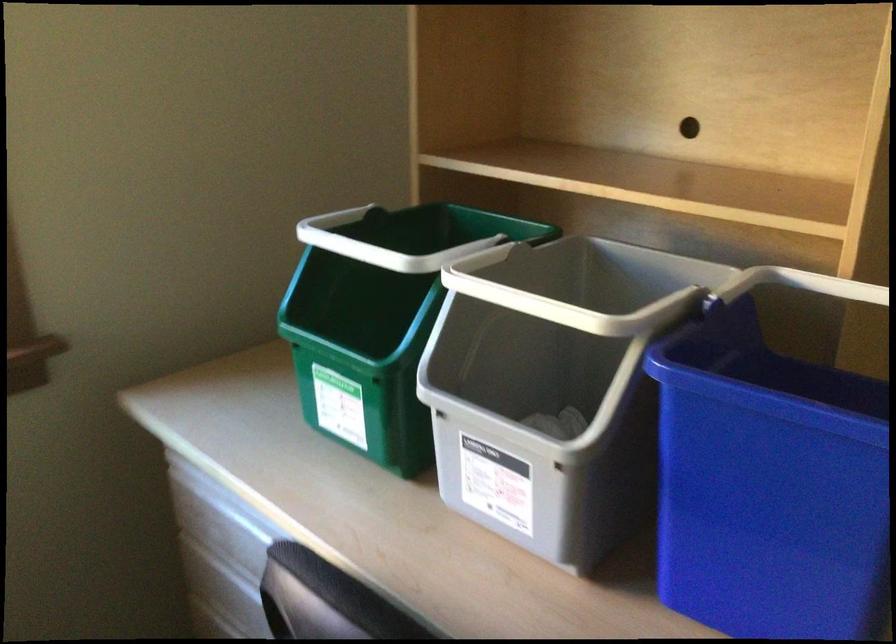
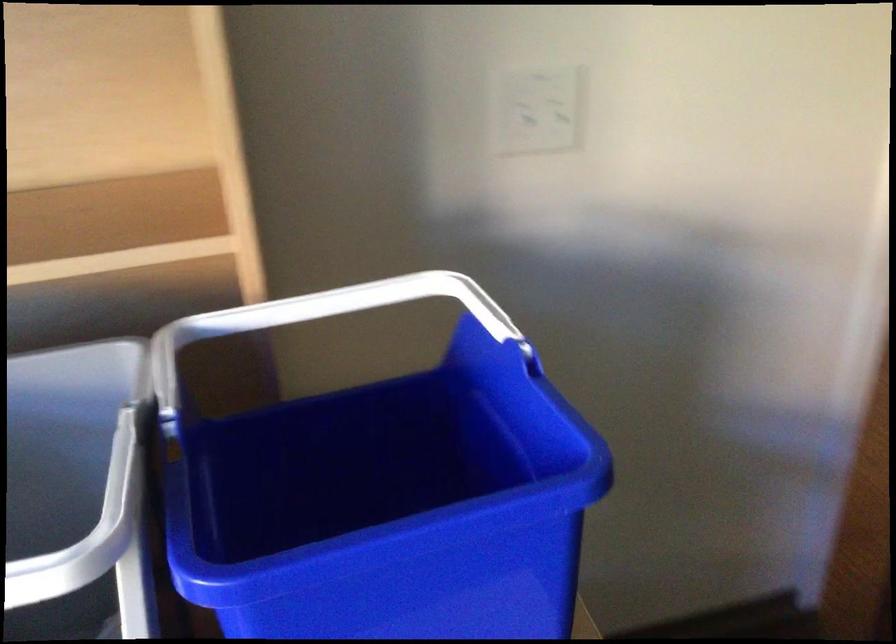
Find the pixel in the second image that matches [641,316] in the first image.

(125, 529)